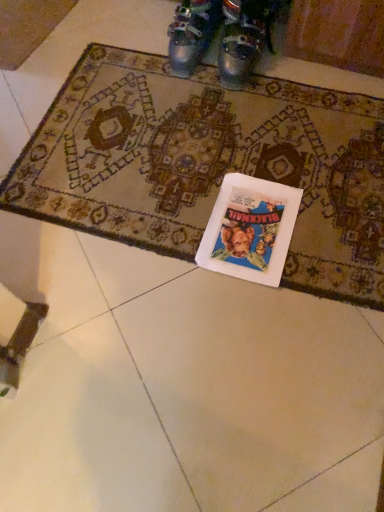
The image size is (384, 512). What are the coordinates of `unoccupied space behind white paper book at center` in the screenshot? It's located at (238, 150).